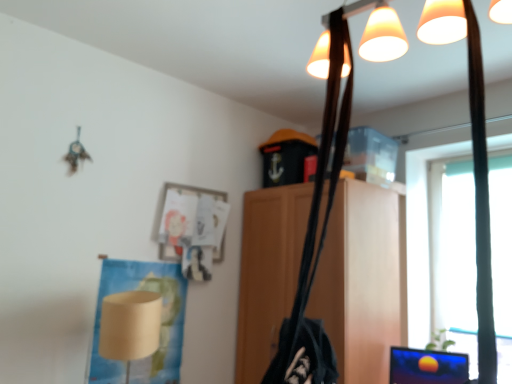
Question: Is wooden cabinet at center taller than beige paper lampshade at lower left?

Choices:
 (A) yes
 (B) no

Answer: (A)

Question: Does wooden cabinet at center have a larger size compared to beige paper lampshade at lower left?

Choices:
 (A) no
 (B) yes

Answer: (B)

Question: Is wooden cabinet at center to the left of beige paper lampshade at lower left from the viewer's perspective?

Choices:
 (A) yes
 (B) no

Answer: (B)

Question: Considering the relative positions of wooden cabinet at center and beige paper lampshade at lower left in the image provided, is wooden cabinet at center to the right of beige paper lampshade at lower left from the viewer's perspective?

Choices:
 (A) yes
 (B) no

Answer: (A)

Question: Is wooden cabinet at center closer to the viewer compared to beige paper lampshade at lower left?

Choices:
 (A) yes
 (B) no

Answer: (B)

Question: Is wooden cabinet at center positioned with its back to beige paper lampshade at lower left?

Choices:
 (A) no
 (B) yes

Answer: (A)

Question: Is transparent plastic window screen at right thinner than beige paper lampshade at lower left?

Choices:
 (A) yes
 (B) no

Answer: (A)

Question: Considering the relative sizes of transparent plastic window screen at right and beige paper lampshade at lower left in the image provided, is transparent plastic window screen at right smaller than beige paper lampshade at lower left?

Choices:
 (A) no
 (B) yes

Answer: (B)

Question: Is transparent plastic window screen at right located outside beige paper lampshade at lower left?

Choices:
 (A) yes
 (B) no

Answer: (A)

Question: Can you confirm if transparent plastic window screen at right is bigger than beige paper lampshade at lower left?

Choices:
 (A) yes
 (B) no

Answer: (B)

Question: Can you confirm if transparent plastic window screen at right is shorter than beige paper lampshade at lower left?

Choices:
 (A) yes
 (B) no

Answer: (B)

Question: Considering the relative sizes of transparent plastic window screen at right and beige paper lampshade at lower left in the image provided, is transparent plastic window screen at right wider than beige paper lampshade at lower left?

Choices:
 (A) yes
 (B) no

Answer: (B)

Question: Considering the relative sizes of wooden cabinet at center and transparent plastic window screen at right in the image provided, is wooden cabinet at center taller than transparent plastic window screen at right?

Choices:
 (A) no
 (B) yes

Answer: (B)